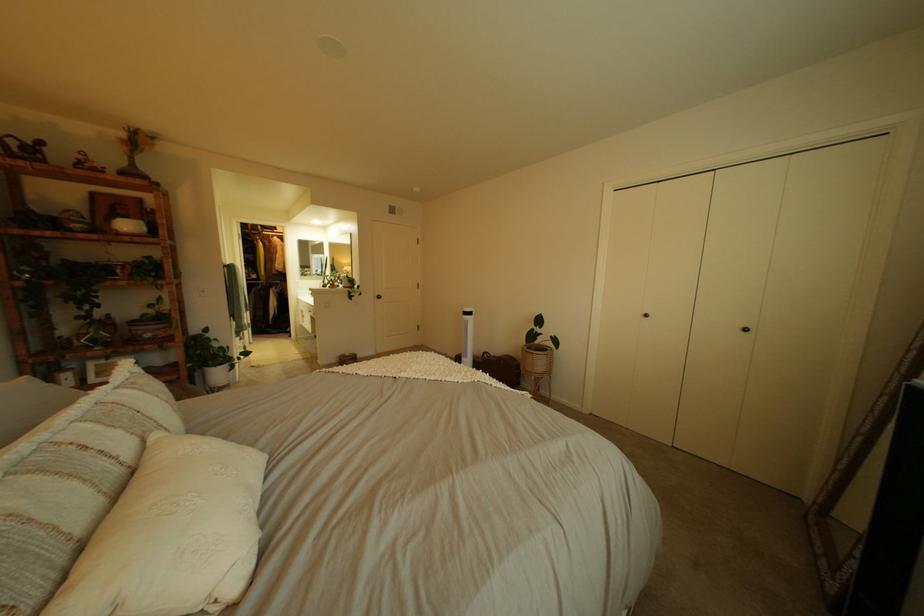
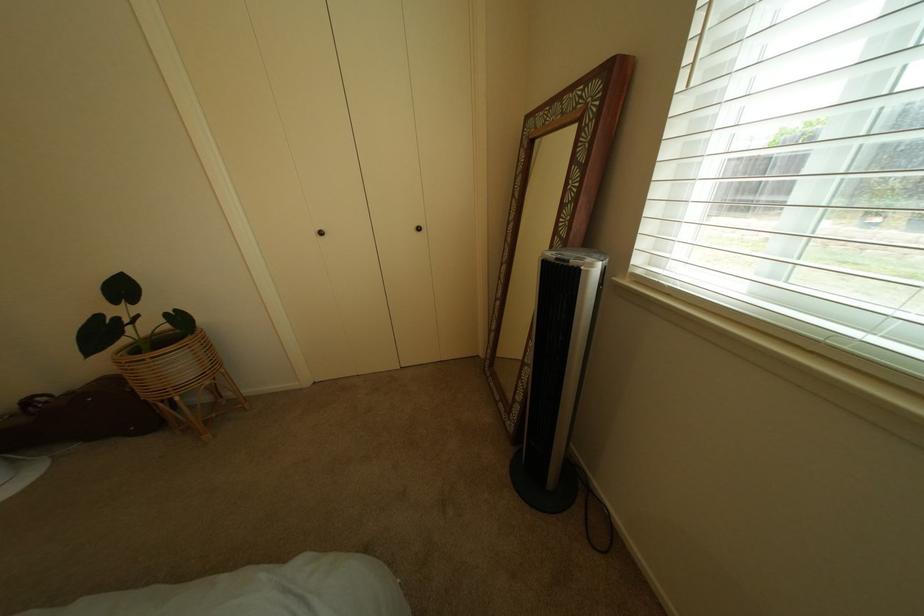
The point at (552,355) is marked in the first image. Where is the corresponding point in the second image?

(167, 359)